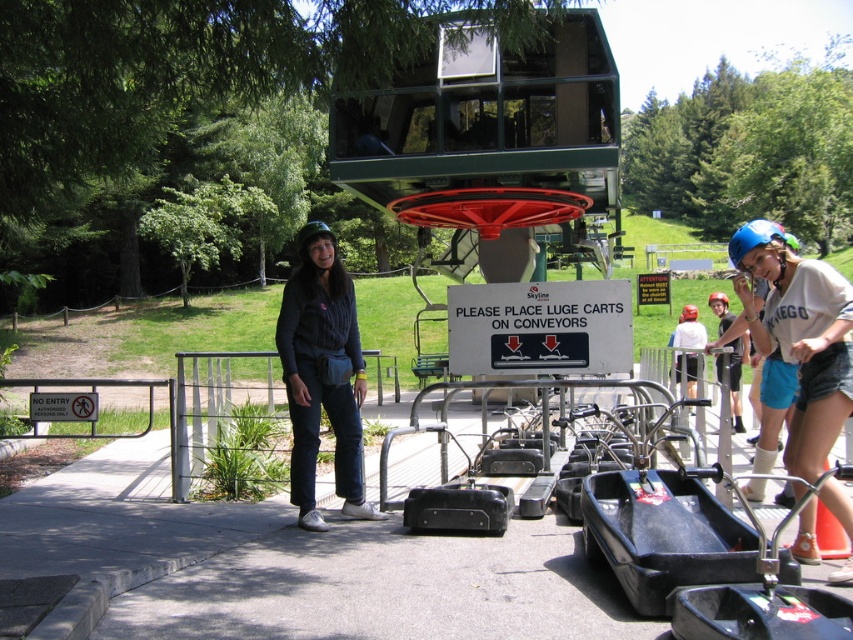
Question: Is denim jeans at center to the right of white plastic sign at center from the viewer's perspective?

Choices:
 (A) yes
 (B) no

Answer: (B)

Question: Can you confirm if denim jeans at center is positioned to the left of white plastic sign at center?

Choices:
 (A) yes
 (B) no

Answer: (A)

Question: Which point is farther to the camera?

Choices:
 (A) white plastic sign at center
 (B) denim jeans at center

Answer: (A)

Question: Which object is the closest to the denim jeans at center?

Choices:
 (A) white plastic sign at center
 (B) blue matte helmet at upper right

Answer: (A)

Question: Which is farther from the white plastic sign at center?

Choices:
 (A) denim jeans at center
 (B) blue matte helmet at upper right

Answer: (B)

Question: Is denim jeans at center above white plastic sign at center?

Choices:
 (A) no
 (B) yes

Answer: (A)